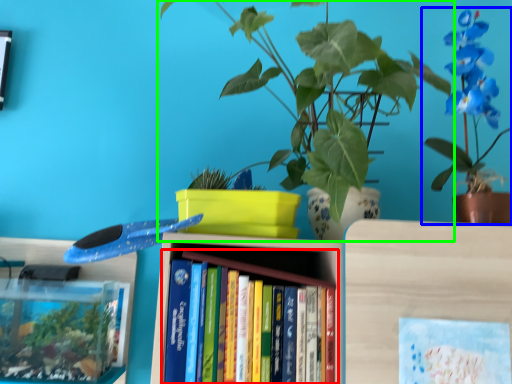
Question: Which object is positioned closest to book (highlighted by a red box)? Select from houseplant (highlighted by a blue box) and houseplant (highlighted by a green box).

Choices:
 (A) houseplant
 (B) houseplant

Answer: (B)